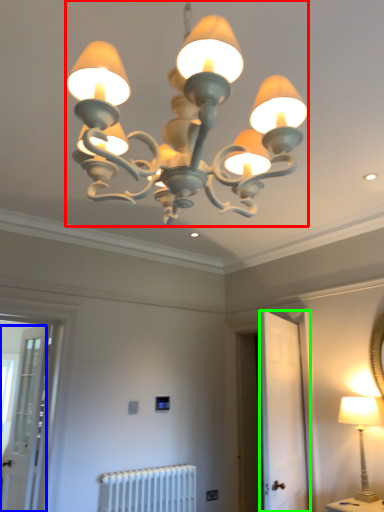
Question: Considering the real-world distances, which object is closest to lamp (highlighted by a red box)? screen door (highlighted by a blue box) or screen door (highlighted by a green box).

Choices:
 (A) screen door
 (B) screen door

Answer: (B)